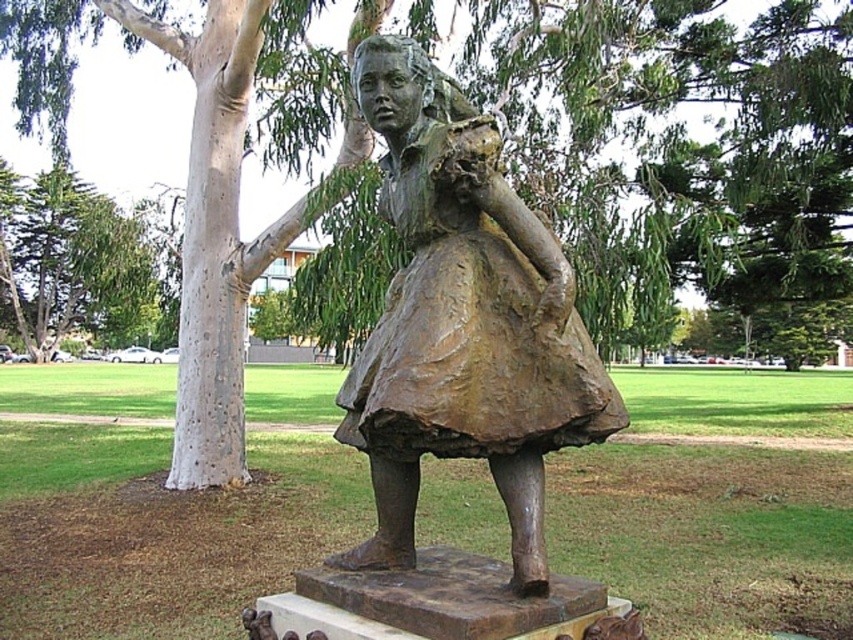
Question: Which point is farther from the camera taking this photo?

Choices:
 (A) (422, 300)
 (B) (79, 193)

Answer: (B)

Question: Is bronze statue at center wider than green leafy tree at left?

Choices:
 (A) no
 (B) yes

Answer: (A)

Question: Which point appears closest to the camera in this image?

Choices:
 (A) (401, 323)
 (B) (96, 246)

Answer: (A)

Question: Can you confirm if bronze statue at center is positioned to the right of green leafy tree at left?

Choices:
 (A) yes
 (B) no

Answer: (A)

Question: In this image, where is bronze statue at center located relative to green leafy tree at left?

Choices:
 (A) right
 (B) left

Answer: (A)

Question: Which object is farther from the camera taking this photo?

Choices:
 (A) green leafy tree at left
 (B) bronze statue at center

Answer: (A)